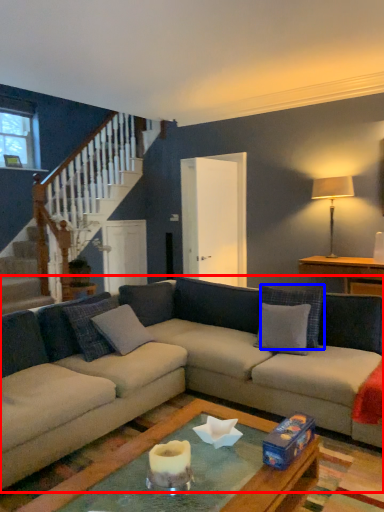
Question: Which object appears closest to the camera in this image, studio couch (highlighted by a red box) or pillow (highlighted by a blue box)?

Choices:
 (A) studio couch
 (B) pillow

Answer: (A)